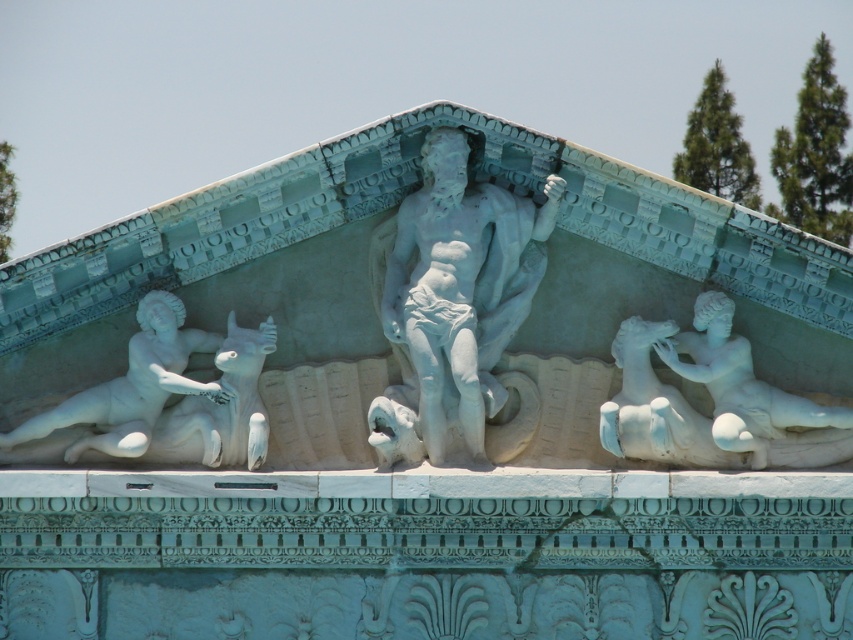
Who is shorter, white marble statue at center or white marble statue at left?

white marble statue at left is shorter.

Looking at this image, is white marble statue at center positioned in front of white marble statue at left?

Yes, white marble statue at center is closer to the viewer.

Image resolution: width=853 pixels, height=640 pixels. Find the location of `white marble statue at center`. white marble statue at center is located at coordinates (451, 300).